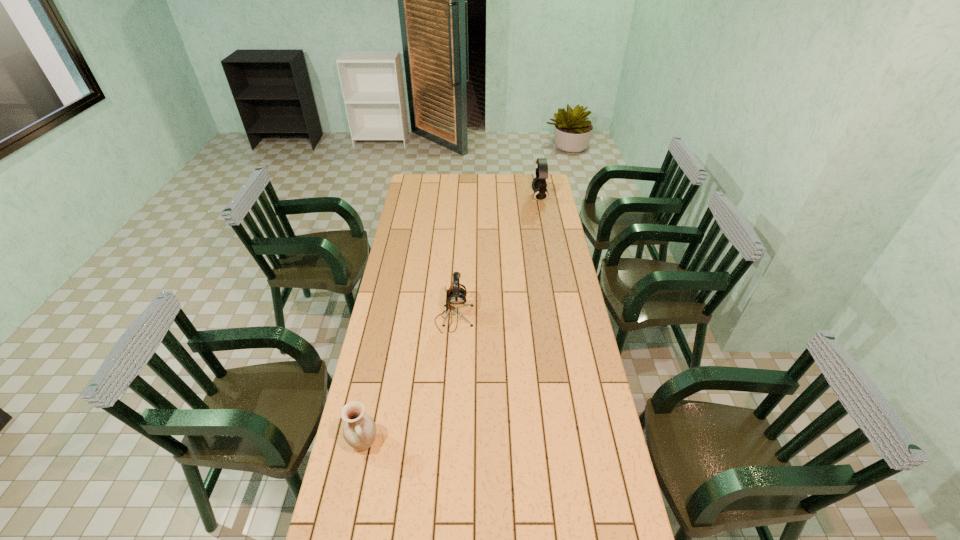
You are a GUI agent. You are given a task and a screenshot of the screen. Output one action in this format:
    pyautogui.click(x=<x>, y=<y>)
    Task: Click on the vacant region located 0.240m on the back of the nearest object
    
    Given the screenshot: What is the action you would take?
    pyautogui.click(x=378, y=370)

I want to click on object that is at the far edge, so click(x=539, y=185).

Where is `object present at the left edge`? The height and width of the screenshot is (540, 960). object present at the left edge is located at coordinates (359, 431).

The height and width of the screenshot is (540, 960). Identify the location of object that is at the right edge. (539, 185).

Identify the location of object present at the far right corner. (539, 185).

In the image, there is a desktop. Identify the location of vacant area at the far edge. (492, 192).

Where is `vacant region at the left edge of the desktop`? vacant region at the left edge of the desktop is located at coordinates [x=417, y=297].

In the image, there is a desktop. Identify the location of free space at the right edge. The width and height of the screenshot is (960, 540). (570, 433).

I want to click on vacant space at the far right corner of the desktop, so click(x=534, y=178).

Where is `vacant area that lies between the nearest object and the second object from right to left`? This screenshot has width=960, height=540. vacant area that lies between the nearest object and the second object from right to left is located at coordinates (409, 381).